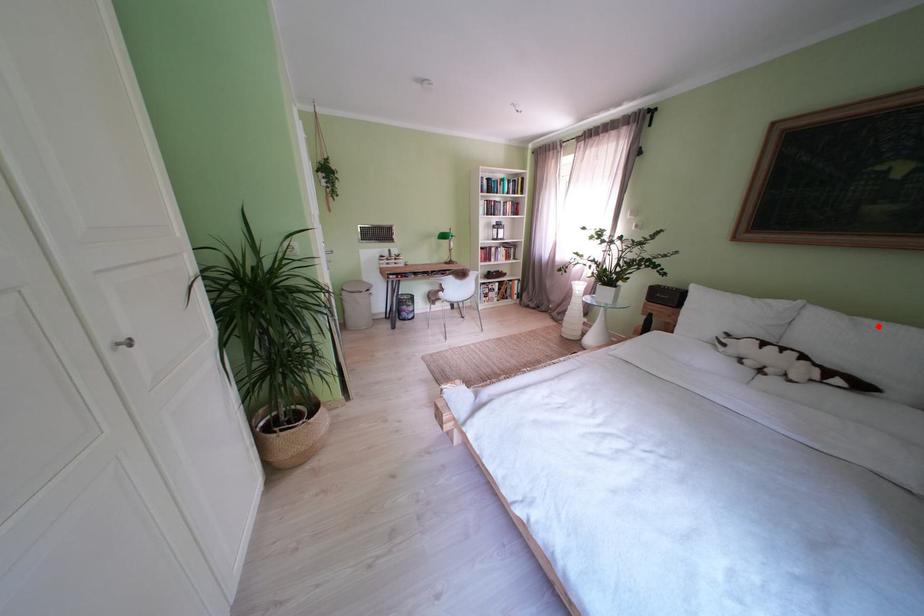
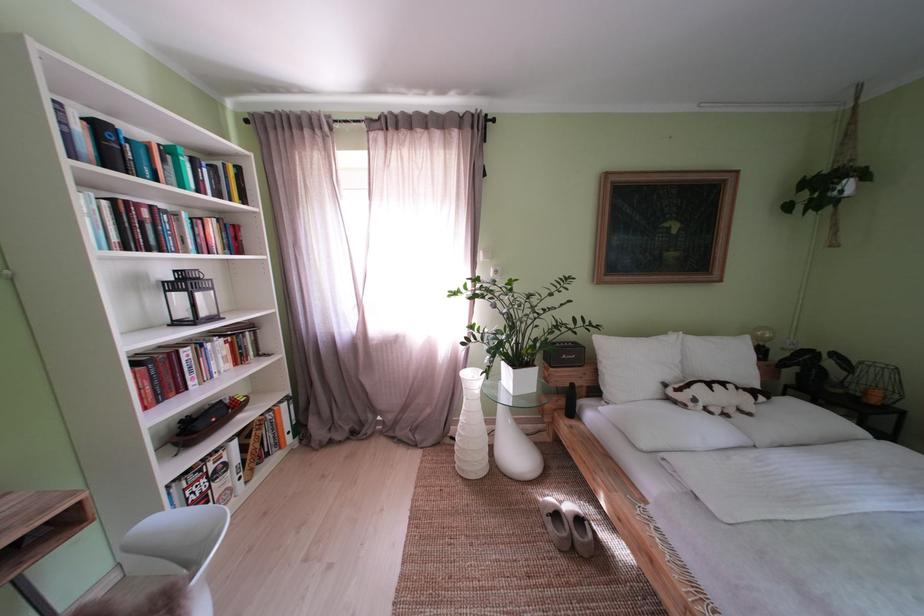
Where in the second image is the point corresponding to the highlighted location from the first image?

(723, 344)